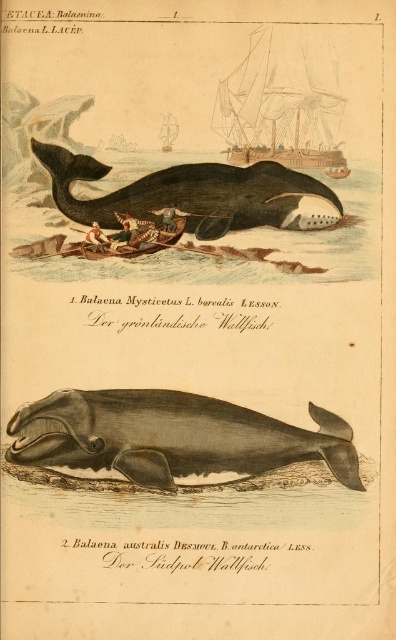
You are an observer looking at the illustration. Which object is positioned to the left between the wooden ship at upper center and the wooden planks boat at upper center?

The wooden ship at upper center is positioned to the left of the wooden planks boat at upper center.

You are an observer looking at the illustration of the two whales. Which object is positioned lower in the image, the gray matte whale at center or the wooden rowboat at center?

The gray matte whale at center is located below the wooden rowboat at center, so it is positioned lower in the image.